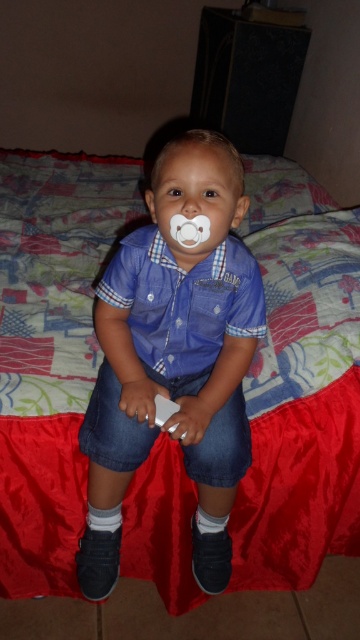
You are a photographer standing at a distance. You want to capture a closeup shot of the blue plaid shirt at center without moving the camera. What adjustment should you make to the camera lens to focus on the shirt?

To capture a closeup shot of the blue plaid shirt at center without moving the camera, you should zoom in the camera lens since the shirt is 38.53 inches away from the camera.

The child is wearing a blue plaid shirt at center and holding a white plastic wii controller at center. Which item takes up more space?

The blue plaid shirt at center has a larger size compared to the white plastic wii controller at center, so the blue plaid shirt at center takes up more space.

Consider the image. You are a photographer taking a picture of the child wearing the blue plaid shirt at center and blue denim shorts at center. Which piece of clothing is positioned closer to the camera?

The blue denim shorts at center is closer to the viewer than the blue plaid shirt at center, so the blue denim shorts at center will appear closer to the camera in the photo.